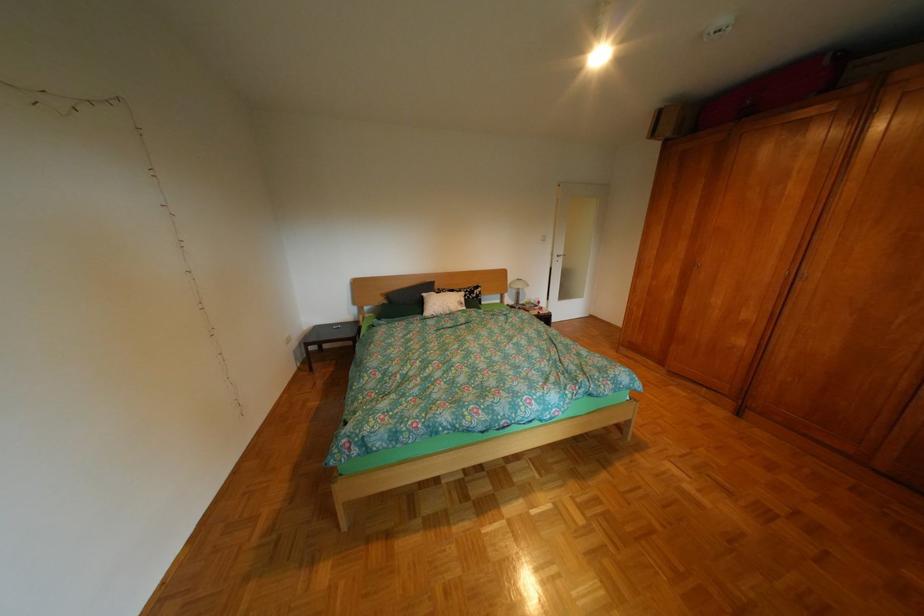
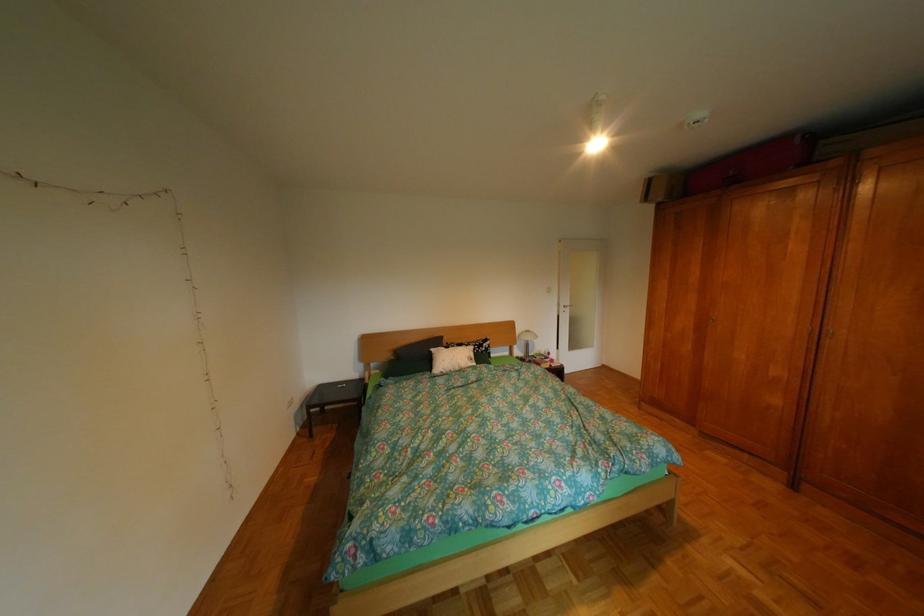
Where in the second image is the point corresponding to [514,297] from the first image?

(523, 349)